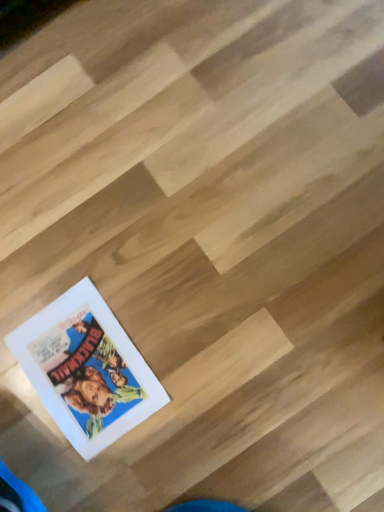
Where is `unoccupied space behind matte paper book at bottom left`? unoccupied space behind matte paper book at bottom left is located at coordinates (48, 260).